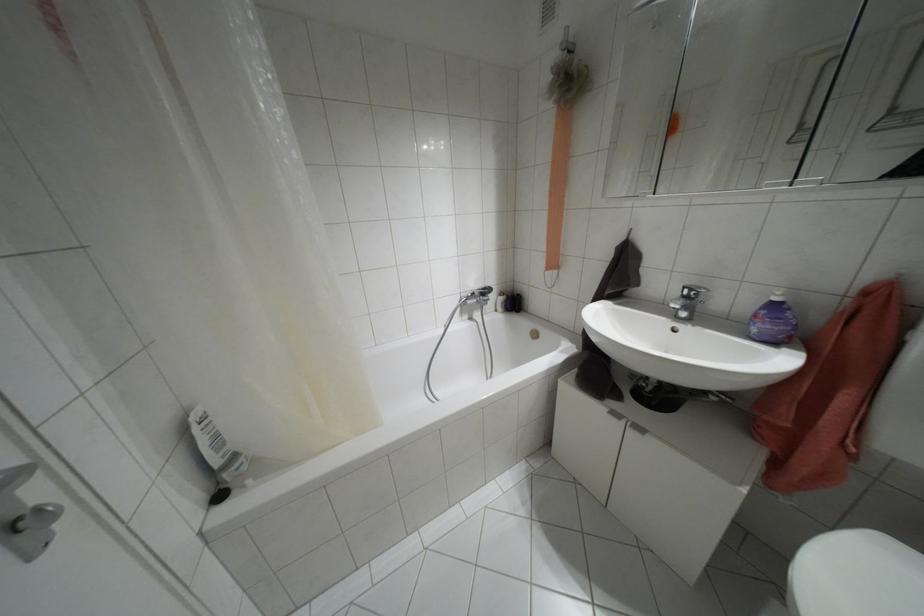
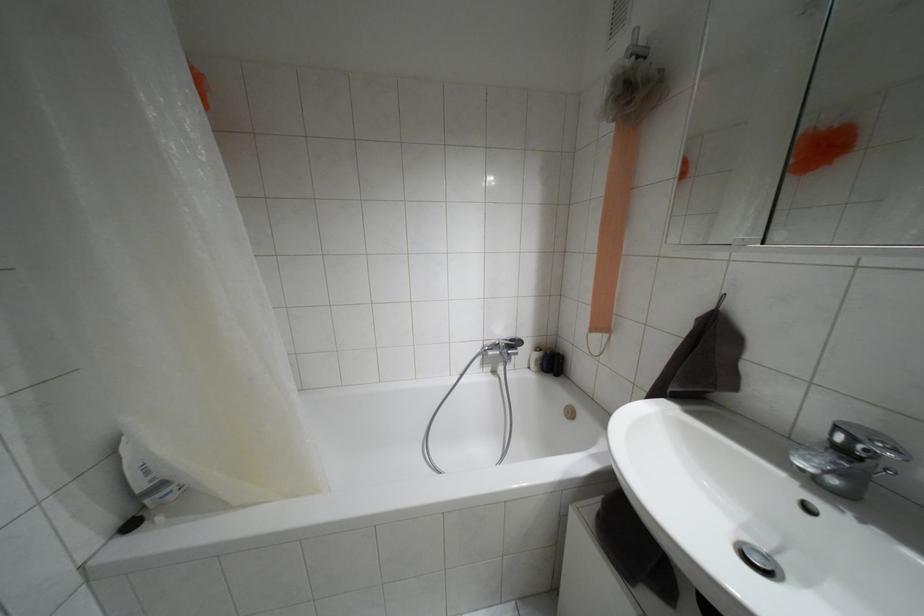
Question: The first image is from the beginning of the video and the second image is from the end. How did the camera likely rotate when shooting the video?

Choices:
 (A) Left
 (B) Right
 (C) Up
 (D) Down

Answer: (A)